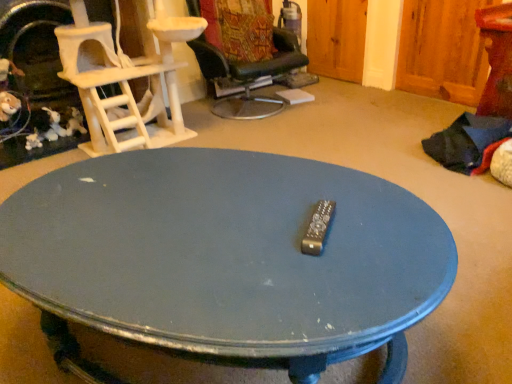
Question: Considering the relative sizes of white textured cat tree at left, positioned as the first chair in left-to-right order, and blue painted wood coffee table at center in the image provided, is white textured cat tree at left, positioned as the first chair in left-to-right order, wider than blue painted wood coffee table at center?

Choices:
 (A) no
 (B) yes

Answer: (A)

Question: Does white textured cat tree at left, positioned as the first chair in left-to-right order, have a lesser width compared to blue painted wood coffee table at center?

Choices:
 (A) yes
 (B) no

Answer: (A)

Question: From the image's perspective, is white textured cat tree at left, arranged as the second chair when viewed from the right, on blue painted wood coffee table at center?

Choices:
 (A) yes
 (B) no

Answer: (A)

Question: From a real-world perspective, is white textured cat tree at left, arranged as the second chair when viewed from the right, located higher than blue painted wood coffee table at center?

Choices:
 (A) yes
 (B) no

Answer: (A)

Question: Is white textured cat tree at left, positioned as the first chair in left-to-right order, facing towards blue painted wood coffee table at center?

Choices:
 (A) no
 (B) yes

Answer: (B)

Question: In the image, is white textured cat tree at left, positioned as the first chair in left-to-right order, positioned in front of or behind black leather chair at upper center, which ranks as the second chair in left-to-right order?

Choices:
 (A) behind
 (B) front

Answer: (B)

Question: Is white textured cat tree at left, positioned as the first chair in left-to-right order, taller or shorter than black leather chair at upper center, which ranks as the second chair in left-to-right order?

Choices:
 (A) tall
 (B) short

Answer: (A)

Question: Considering the positions of white textured cat tree at left, arranged as the second chair when viewed from the right, and black leather chair at upper center, which ranks as the second chair in left-to-right order, in the image, is white textured cat tree at left, arranged as the second chair when viewed from the right, wider or thinner than black leather chair at upper center, which ranks as the second chair in left-to-right order,?

Choices:
 (A) wide
 (B) thin

Answer: (B)

Question: In the image, is white textured cat tree at left, arranged as the second chair when viewed from the right, on the left side or the right side of black leather chair at upper center, acting as the 1th chair starting from the right?

Choices:
 (A) left
 (B) right

Answer: (A)

Question: From a real-world perspective, is blue painted wood coffee table at center physically located above or below white textured cat tree at left, positioned as the first chair in left-to-right order?

Choices:
 (A) below
 (B) above

Answer: (A)

Question: Do you think blue painted wood coffee table at center is within white textured cat tree at left, positioned as the first chair in left-to-right order, or outside of it?

Choices:
 (A) inside
 (B) outside

Answer: (B)

Question: Relative to white textured cat tree at left, arranged as the second chair when viewed from the right, is blue painted wood coffee table at center in front or behind?

Choices:
 (A) behind
 (B) front

Answer: (B)

Question: From the image's perspective, is blue painted wood coffee table at center located above or below white textured cat tree at left, positioned as the first chair in left-to-right order?

Choices:
 (A) below
 (B) above

Answer: (A)

Question: Is point (238, 278) positioned closer to the camera than point (232, 41)?

Choices:
 (A) closer
 (B) farther

Answer: (A)

Question: Is blue painted wood coffee table at center in front of or behind black leather chair at upper center, acting as the 1th chair starting from the right, in the image?

Choices:
 (A) behind
 (B) front

Answer: (B)